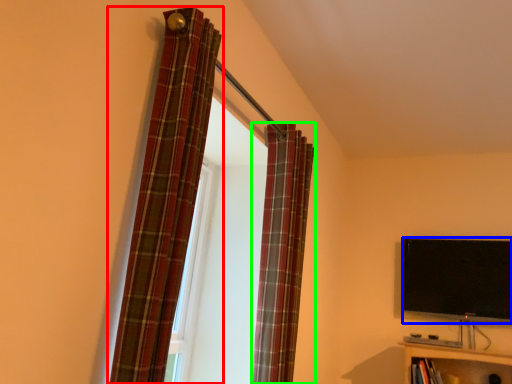
Question: Which object is the farthest from curtain (highlighted by a red box)? Choose among these: television (highlighted by a blue box) or curtain (highlighted by a green box).

Choices:
 (A) television
 (B) curtain

Answer: (A)